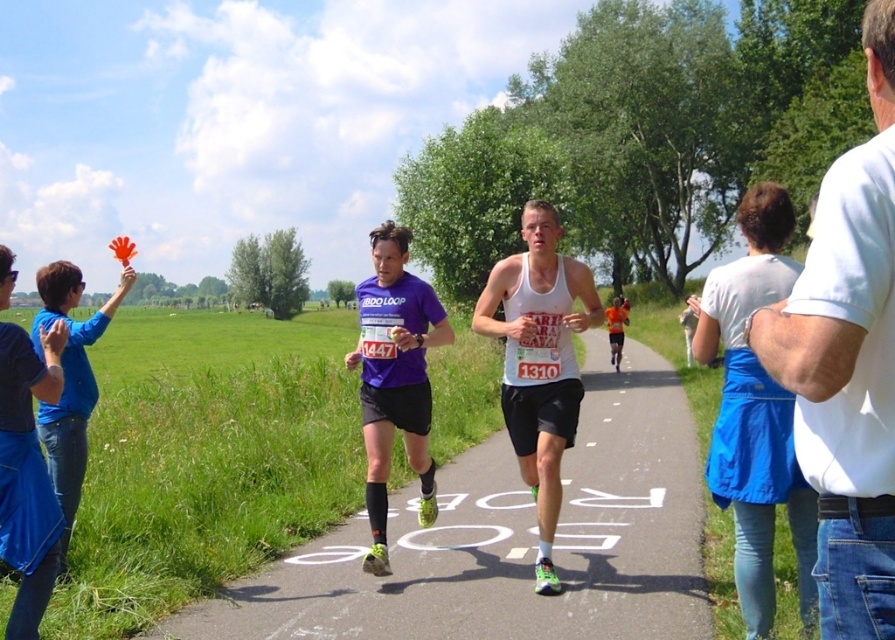
Question: Does purple fabric shirt at center have a lesser width compared to matte purple shirt at center?

Choices:
 (A) no
 (B) yes

Answer: (B)

Question: Which point is farther to the camera?

Choices:
 (A) (x=9, y=506)
 (B) (x=64, y=385)
 (C) (x=803, y=330)

Answer: (B)

Question: Which is nearer to the asphalt road at center?

Choices:
 (A) white cotton shirt at right
 (B) white matte tank top at center
 (C) blue fabric apron at right
 (D) matte purple shirt at center

Answer: (C)

Question: Is blue fabric apron at right further to camera compared to matte purple shirt at center?

Choices:
 (A) yes
 (B) no

Answer: (B)

Question: From the image, what is the correct spatial relationship of asphalt road at center in relation to purple fabric shirt at center?

Choices:
 (A) left
 (B) right

Answer: (B)

Question: Which point is closer to the camera?

Choices:
 (A) white matte tank top at center
 (B) matte purple shirt at center

Answer: (B)